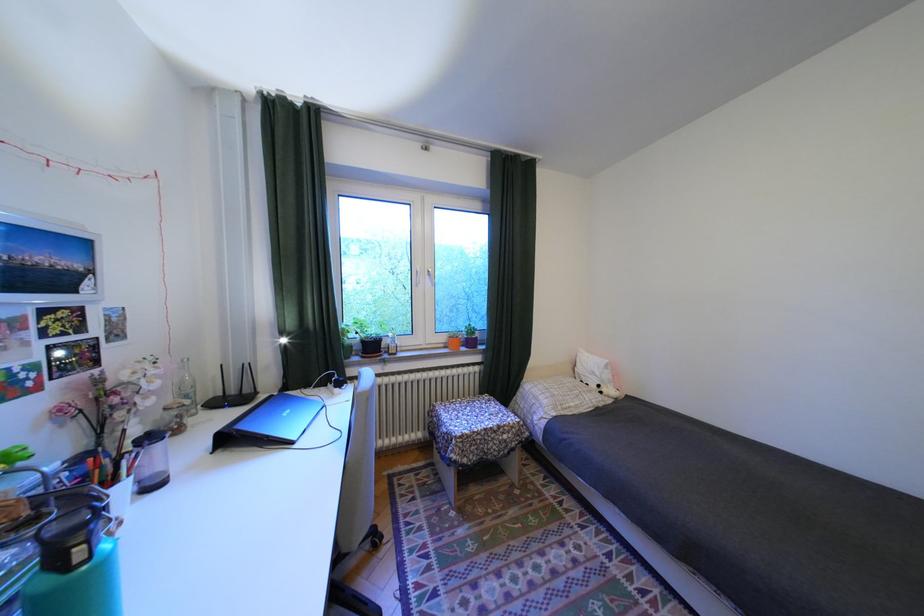
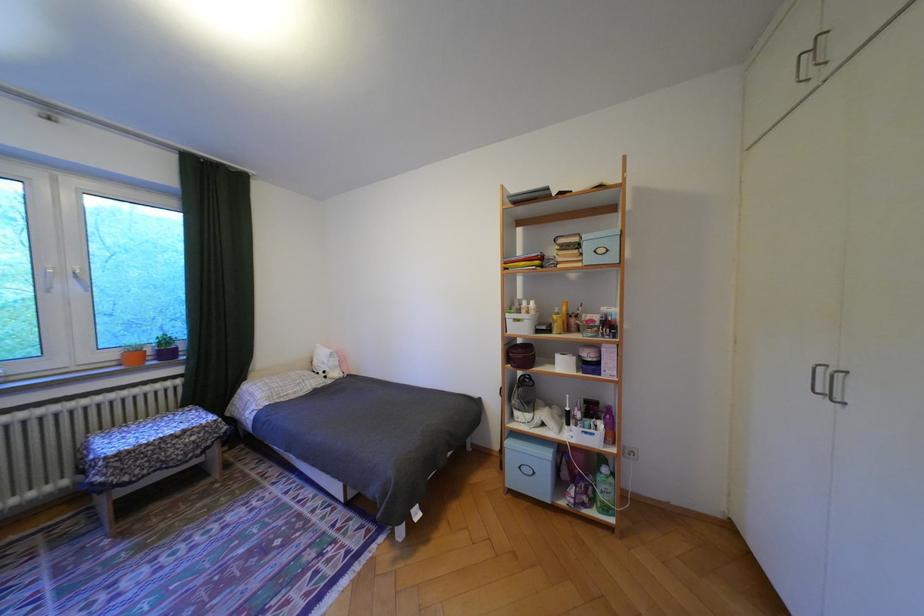
The point at (439, 277) is marked in the first image. Where is the corresponding point in the second image?

(84, 280)